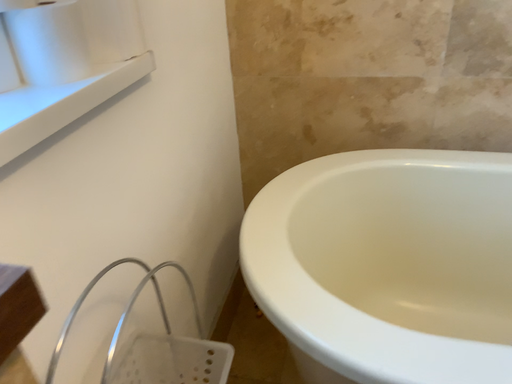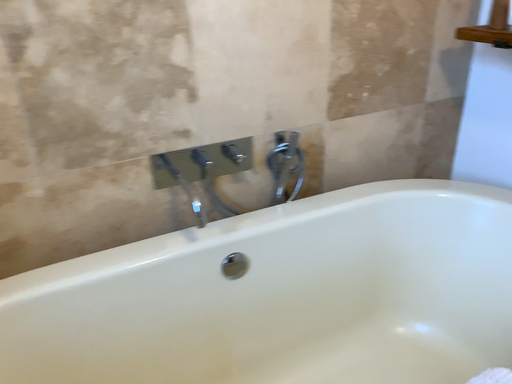
Question: How did the camera likely rotate when shooting the video?

Choices:
 (A) rotated downward
 (B) rotated upward

Answer: (B)